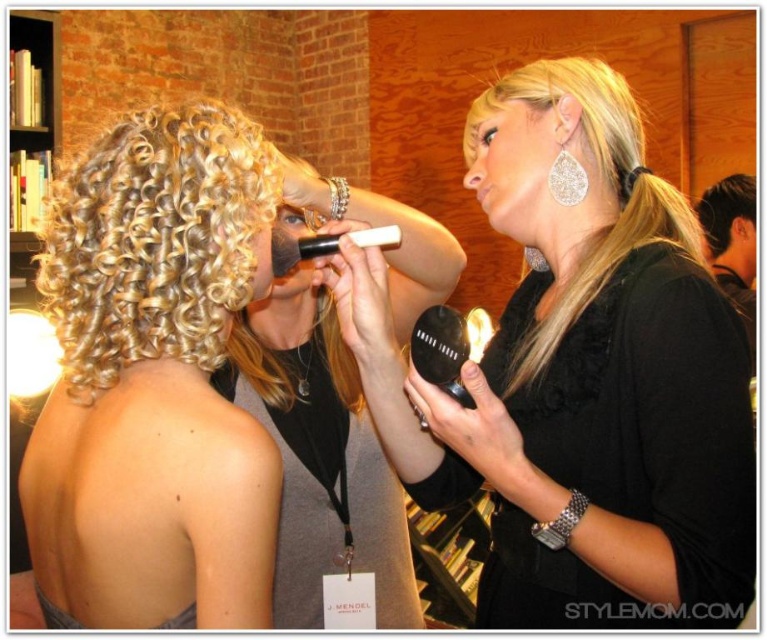
You are a photographer trying to capture the makeup artist and the model. You want to ensure that both the curly blonde hair at back and the matte black makeup brush at center are visible in your shot. Based on their positions, which object is closer to the left side of the frame?

The curly blonde hair at back is to the left of the matte black makeup brush at center, so the curly blonde hair at back is closer to the left side of the frame.

You are a photographer setting up for a photoshoot and need to position a light source. You see the curly blonde hair at back and the satin black dress at upper right. Which object is shorter in height?

The curly blonde hair at back is shorter in height than the satin black dress at upper right according to the description.

You are a photographer at a fashion event. You want to take a photo of the model wearing the satin black dress at upper right. However, the curly blonde hair at back is blocking your view. Can you still see the dress?

The curly blonde hair at back is in front of the satin black dress at upper right, so the dress is currently blocked by the hair and not fully visible.